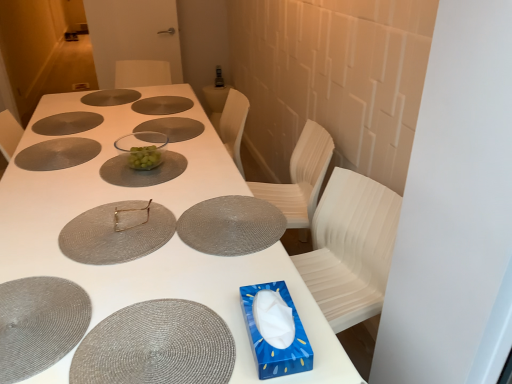
Where is `free space between matte gray glass plate at upper left, the third glass plate in the back-to-front sequence, and matte gray placemat at lower center, the ninth glass plate from the back`? The width and height of the screenshot is (512, 384). free space between matte gray glass plate at upper left, the third glass plate in the back-to-front sequence, and matte gray placemat at lower center, the ninth glass plate from the back is located at coordinates (90, 182).